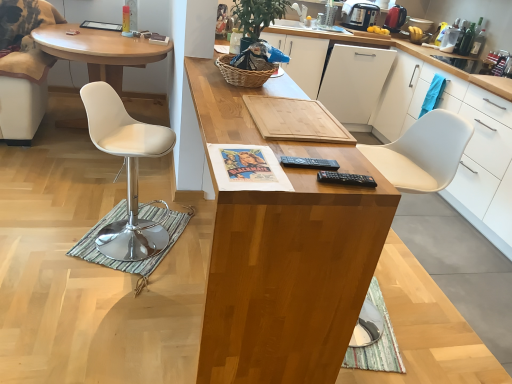
This screenshot has width=512, height=384. I want to click on vacant space in front of white leather desk at left, the 1th desk viewed from the left, so click(68, 186).